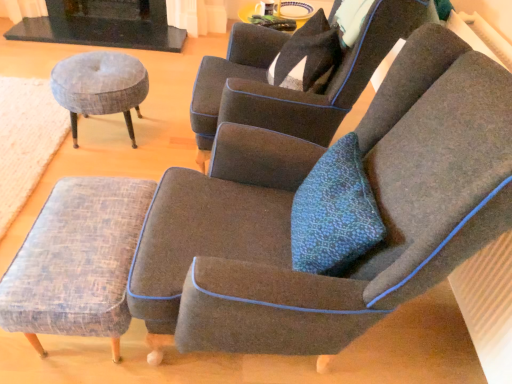
Question: Does woven fabric ottoman at lower left have a larger size compared to dark gray fabric chair at upper center, the 1th chair in the back-to-front sequence?

Choices:
 (A) no
 (B) yes

Answer: (A)

Question: Can you confirm if woven fabric ottoman at lower left is thinner than dark gray fabric chair at upper center, the 1th chair in the back-to-front sequence?

Choices:
 (A) yes
 (B) no

Answer: (B)

Question: From a real-world perspective, is woven fabric ottoman at lower left physically below dark gray fabric chair at upper center, arranged as the 2th chair when viewed from the front?

Choices:
 (A) no
 (B) yes

Answer: (B)

Question: Does woven fabric ottoman at lower left have a greater height compared to dark gray fabric chair at upper center, arranged as the 2th chair when viewed from the front?

Choices:
 (A) yes
 (B) no

Answer: (B)

Question: Is woven fabric ottoman at lower left oriented away from dark gray fabric chair at upper center, the 1th chair in the back-to-front sequence?

Choices:
 (A) yes
 (B) no

Answer: (B)

Question: Is point (67, 213) positioned closer to the camera than point (99, 107)?

Choices:
 (A) closer
 (B) farther

Answer: (A)

Question: Is textured gray stool at lower left, which is counted as the first stool, starting from the front, taller or shorter than textured gray fabric stool at left, the second stool positioned from the bottom?

Choices:
 (A) tall
 (B) short

Answer: (B)

Question: Is textured gray stool at lower left, the first stool positioned from the bottom, wider or thinner than textured gray fabric stool at left, arranged as the first stool when viewed from the back?

Choices:
 (A) wide
 (B) thin

Answer: (B)

Question: From the image's perspective, is textured gray stool at lower left, the first stool positioned from the bottom, above or below textured gray fabric stool at left, placed as the first stool when sorted from top to bottom?

Choices:
 (A) below
 (B) above

Answer: (A)

Question: From the image's perspective, is textured gray stool at lower left, which is the second stool in back-to-front order, above or below dark gray fabric chair at center, acting as the first chair starting from the front?

Choices:
 (A) below
 (B) above

Answer: (A)

Question: From a real-world perspective, is textured gray stool at lower left, which is counted as the first stool, starting from the front, physically located above or below dark gray fabric chair at center, the 2th chair positioned from the back?

Choices:
 (A) above
 (B) below

Answer: (B)

Question: Considering the positions of textured gray stool at lower left, marked as the second stool in a top-to-bottom arrangement, and dark gray fabric chair at center, the 2th chair positioned from the back, in the image, is textured gray stool at lower left, marked as the second stool in a top-to-bottom arrangement, wider or thinner than dark gray fabric chair at center, the 2th chair positioned from the back,?

Choices:
 (A) thin
 (B) wide

Answer: (A)

Question: Looking at the image, does textured gray stool at lower left, which is the second stool in back-to-front order, seem bigger or smaller compared to dark gray fabric chair at center, the 2th chair positioned from the back?

Choices:
 (A) small
 (B) big

Answer: (A)

Question: Is textured gray stool at lower left, the first stool positioned from the bottom, wider or thinner than dark gray fabric chair at upper center, the 1th chair in the back-to-front sequence?

Choices:
 (A) wide
 (B) thin

Answer: (B)

Question: Based on their positions, is textured gray stool at lower left, marked as the second stool in a top-to-bottom arrangement, located to the left or right of dark gray fabric chair at upper center, the 1th chair in the back-to-front sequence?

Choices:
 (A) right
 (B) left

Answer: (B)